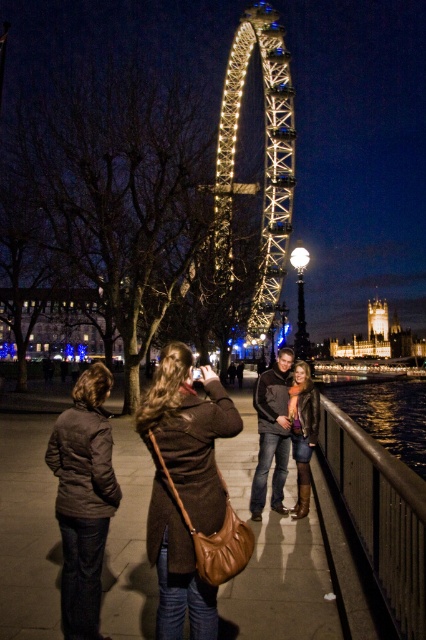
Question: Considering the real-world distances, which object is closest to the stone tower at right?

Choices:
 (A) dark brown quilted jacket at lower left
 (B) brown leather purse at center
 (C) leather jacket at center

Answer: (C)

Question: Which point is farther to the camera?

Choices:
 (A) stone tower at right
 (B) dark brown quilted jacket at lower left
 (C) illuminated steel ferris wheel at center

Answer: (A)

Question: Considering the relative positions of dark brown quilted jacket at lower left and leather jacket at center in the image provided, where is dark brown quilted jacket at lower left located with respect to leather jacket at center?

Choices:
 (A) above
 (B) below

Answer: (B)

Question: Is the position of illuminated steel ferris wheel at center less distant than that of leather jacket at center?

Choices:
 (A) yes
 (B) no

Answer: (A)

Question: Does brown leather purse at center come in front of leather jacket at center?

Choices:
 (A) yes
 (B) no

Answer: (A)

Question: Which object is positioned closest to the leather jacket at center?

Choices:
 (A) stone tower at right
 (B) illuminated steel ferris wheel at center
 (C) dark brown quilted jacket at lower left

Answer: (B)